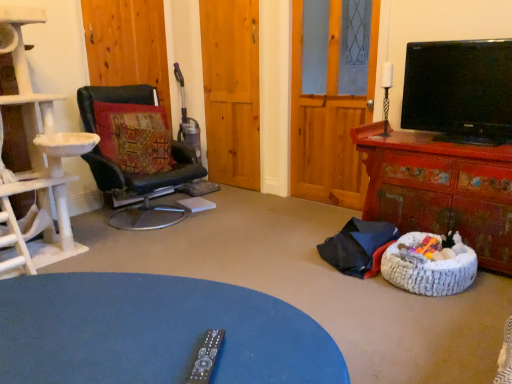
The image size is (512, 384). What are the coordinates of `free space in front of white woven dog bed at lower right` in the screenshot? It's located at (447, 314).